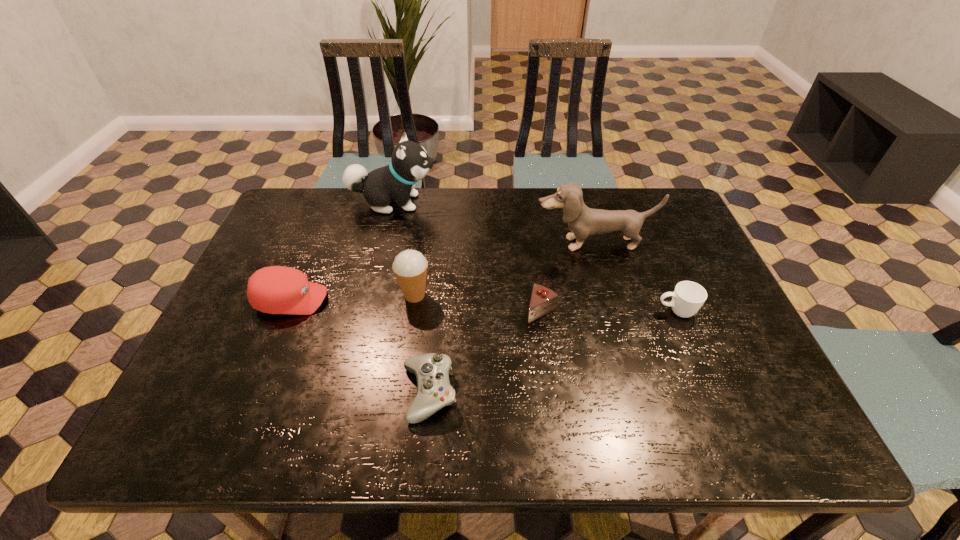
Identify the location of blank area in the image that satisfies the following two spatial constraints: 1. at the face of the nearest object; 2. on the left side of the farther puppy. The width and height of the screenshot is (960, 540). (348, 393).

This screenshot has height=540, width=960. What are the coordinates of `free spot that satisfies the following two spatial constraints: 1. on the front-facing side of the fourth tallest object; 2. on the right side of the chocolate cake` in the screenshot? It's located at (287, 310).

Locate an element on the screen. This screenshot has height=540, width=960. free point that satisfies the following two spatial constraints: 1. on the front side of the control; 2. on the right side of the icecream is located at coordinates (400, 393).

This screenshot has height=540, width=960. Identify the location of vacant position in the image that satisfies the following two spatial constraints: 1. at the face of the farther puppy; 2. on the left side of the control. (348, 393).